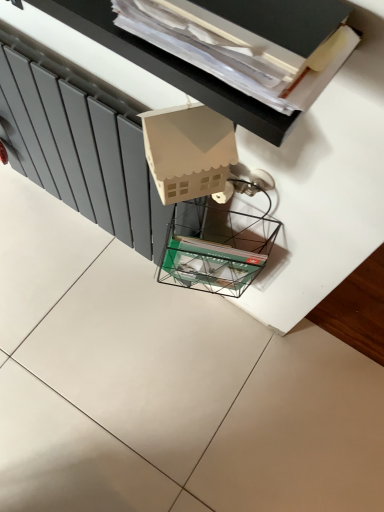
What do you see at coordinates (215, 246) in the screenshot? I see `clear glass magazine rack at center` at bounding box center [215, 246].

The image size is (384, 512). Describe the element at coordinates (323, 193) in the screenshot. I see `matte gray radiator at left` at that location.

Measure the distance between matte gray radiator at left and camera.

matte gray radiator at left is 18.67 inches from camera.

I want to click on clear glass magazine rack at center, so click(215, 246).

Which of these two, matte gray radiator at left or matte cardboard house at upper center, stands taller?

Standing taller between the two is matte gray radiator at left.

Which of these two, matte gray radiator at left or matte cardboard house at upper center, is thinner?

matte gray radiator at left is thinner.

Consider the image. Is the surface of matte gray radiator at left in direct contact with matte cardboard house at upper center?

No.

Find the location of a particular element. Image resolution: width=384 pixels, height=512 pixels. vanity above the matte gray radiator at left (from the image's perspective) is located at coordinates (169, 67).

Is clear glass magazine rack at center in front of or behind matte cardboard house at upper center in the image?

In the image, clear glass magazine rack at center appears behind matte cardboard house at upper center.

Is clear glass magazine rack at center facing towards matte cardboard house at upper center?

No, clear glass magazine rack at center is not turned towards matte cardboard house at upper center.

Looking at this image, is matte cardboard house at upper center located within clear glass magazine rack at center?

No, matte cardboard house at upper center is not surrounded by clear glass magazine rack at center.

Is matte gray radiator at left at the left side of clear glass magazine rack at center?

Indeed, matte gray radiator at left is positioned on the left side of clear glass magazine rack at center.

Can you confirm if matte gray radiator at left is taller than clear glass magazine rack at center?

Yes, matte gray radiator at left is taller than clear glass magazine rack at center.

Which is closer to the camera, (290, 323) or (232, 220)?

Point (290, 323) is positioned farther from the camera compared to point (232, 220).

How much distance is there between matte gray radiator at left and clear glass magazine rack at center?

6.13 inches.

I want to click on glass box that appears above the matte gray radiator at left (from a real-world perspective), so click(x=215, y=246).

Can you confirm if clear glass magazine rack at center is smaller than matte gray radiator at left?

Yes, clear glass magazine rack at center is smaller than matte gray radiator at left.

From their relative heights in the image, would you say clear glass magazine rack at center is taller or shorter than matte gray radiator at left?

Considering their sizes, clear glass magazine rack at center has less height than matte gray radiator at left.

Would you say clear glass magazine rack at center is outside matte gray radiator at left?

Indeed, clear glass magazine rack at center is completely outside matte gray radiator at left.

The width and height of the screenshot is (384, 512). In order to click on glass box on the right of matte cardboard house at upper center in this screenshot , I will do `click(215, 246)`.

Between matte cardboard house at upper center and clear glass magazine rack at center, which one has smaller width?

clear glass magazine rack at center.

Consider the image. From a real-world perspective, is matte cardboard house at upper center positioned above or below clear glass magazine rack at center?

Clearly, from a real-world perspective, matte cardboard house at upper center is above clear glass magazine rack at center.

Can you confirm if matte cardboard house at upper center is shorter than clear glass magazine rack at center?

Correct, matte cardboard house at upper center is not as tall as clear glass magazine rack at center.

Is the depth of matte cardboard house at upper center greater than that of matte gray radiator at left?

No, matte cardboard house at upper center is in front of matte gray radiator at left.

Considering the sizes of objects matte cardboard house at upper center and matte gray radiator at left in the image provided, who is bigger, matte cardboard house at upper center or matte gray radiator at left?

matte gray radiator at left.

From the image's perspective, between matte cardboard house at upper center and matte gray radiator at left, which one is located above?

matte cardboard house at upper center is shown above in the image.

At what (x,y) coordinates should I click in order to perform the action: click on furniture behind the matte cardboard house at upper center. Please return your answer as a coordinate pair (x, y). Image resolution: width=384 pixels, height=512 pixels. Looking at the image, I should click on (323, 193).

You are a GUI agent. You are given a task and a screenshot of the screen. Output one action in this format:
    pyautogui.click(x=<x>, y=<y>)
    Task: Click on the glass box that appears below the matte cardboard house at upper center (from a real-world perspective)
    
    Given the screenshot: What is the action you would take?
    pyautogui.click(x=215, y=246)

Based on their spatial positions, is matte cardboard house at upper center or matte gray radiator at left closer to clear glass magazine rack at center?

Among the two, matte gray radiator at left is located nearer to clear glass magazine rack at center.

Considering their positions, is clear glass magazine rack at center positioned closer to matte gray radiator at left than matte cardboard house at upper center?

Among the two, clear glass magazine rack at center is located nearer to matte gray radiator at left.

Based on their spatial positions, is clear glass magazine rack at center or matte gray radiator at left further from matte cardboard house at upper center?

clear glass magazine rack at center is further to matte cardboard house at upper center.

From the image, which object appears to be farther from matte cardboard house at upper center, matte gray radiator at left or clear glass magazine rack at center?

Based on the image, clear glass magazine rack at center appears to be further to matte cardboard house at upper center.

From the image, which object appears to be farther from matte gray radiator at left, matte cardboard house at upper center or clear glass magazine rack at center?

Among the two, matte cardboard house at upper center is located further to matte gray radiator at left.

Based on their spatial positions, is matte gray radiator at left or matte cardboard house at upper center closer to clear glass magazine rack at center?

The object closer to clear glass magazine rack at center is matte gray radiator at left.

Where is `furniture between matte cardboard house at upper center and clear glass magazine rack at center along the z-axis`? This screenshot has width=384, height=512. furniture between matte cardboard house at upper center and clear glass magazine rack at center along the z-axis is located at coordinates (323, 193).